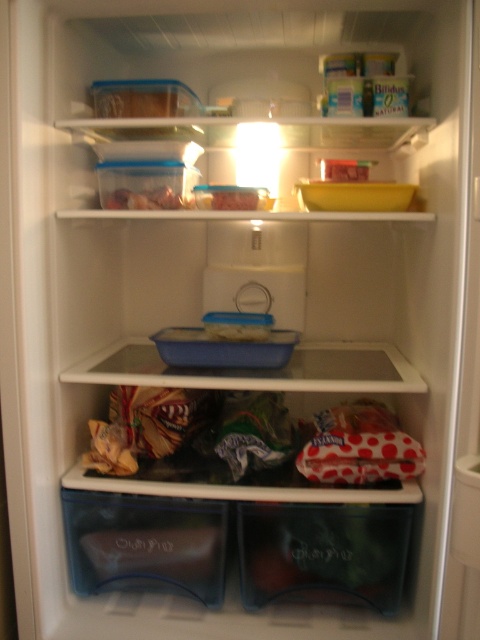
Is point (386, 456) positioned in front of point (173, 202)?

Yes, point (386, 456) is in front of point (173, 202).

Consider the image. Does polka dot fabric bag at center have a larger size compared to translucent plastic container at upper center?

Indeed, polka dot fabric bag at center has a larger size compared to translucent plastic container at upper center.

Image resolution: width=480 pixels, height=640 pixels. I want to click on polka dot fabric bag at center, so click(252, 440).

At what (x,y) coordinates should I click in order to perform the action: click on polka dot fabric bag at center. Please return your answer as a coordinate pair (x, y). Looking at the image, I should click on (252, 440).